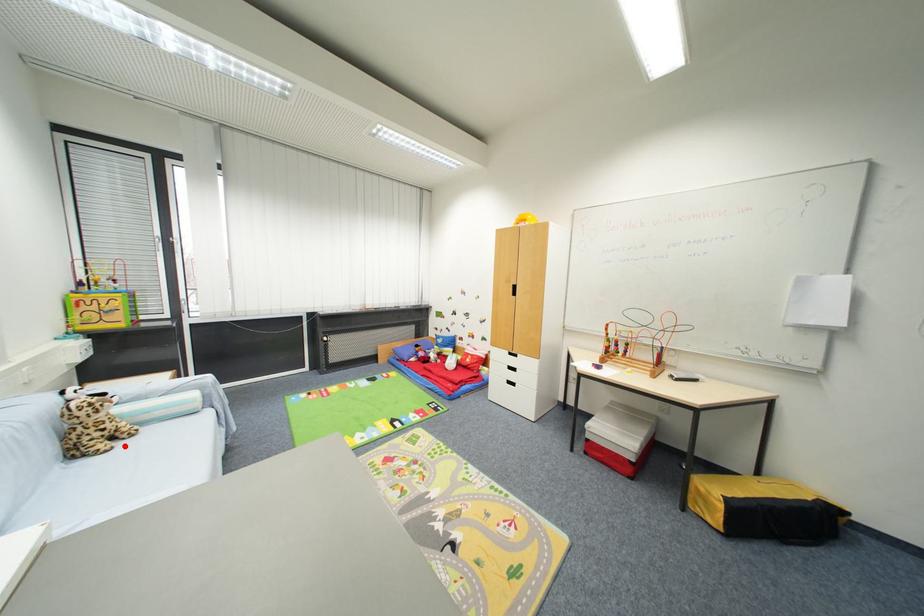
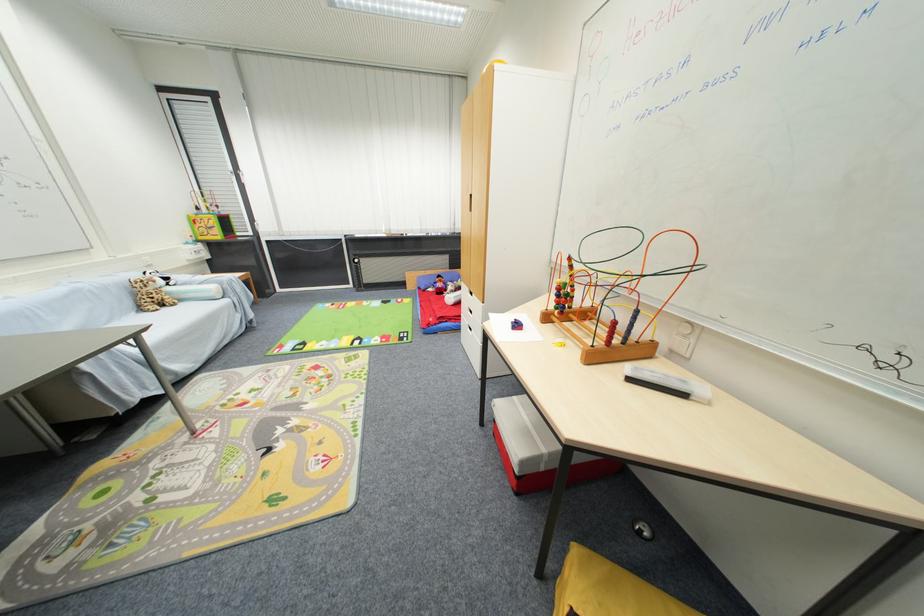
Locate, in the second image, the point that corresponds to the highlighted location in the first image.

(171, 310)